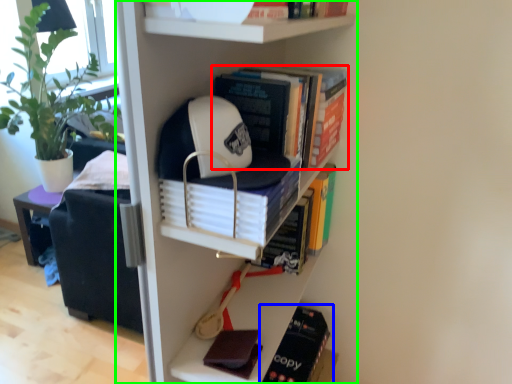
Question: Which object is the farthest from book (highlighted by a red box)? Choose among these: book (highlighted by a blue box) or bookcase (highlighted by a green box).

Choices:
 (A) book
 (B) bookcase

Answer: (A)